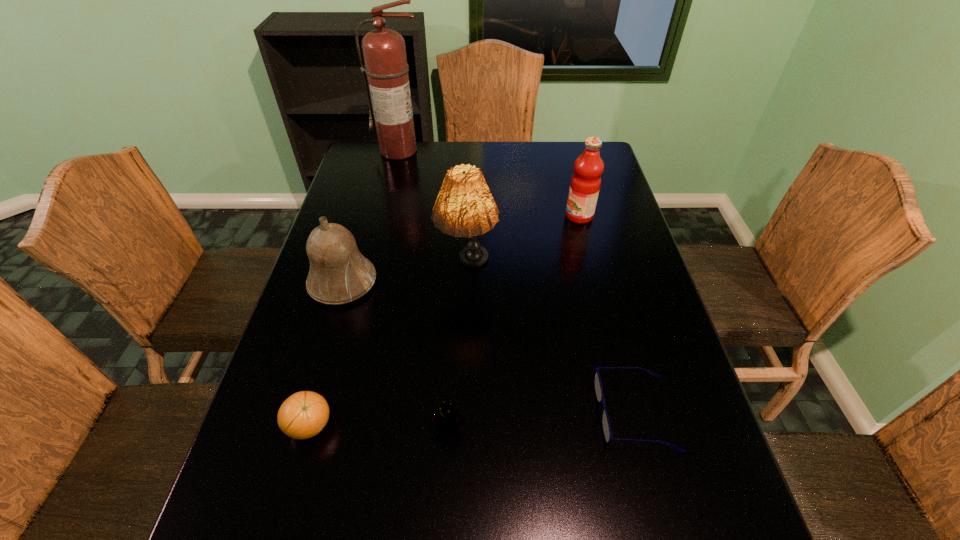
Find the location of a particular element. The height and width of the screenshot is (540, 960). the tallest object is located at coordinates (384, 52).

The height and width of the screenshot is (540, 960). What are the coordinates of `the farthest object` in the screenshot? It's located at (384, 52).

You are a GUI agent. You are given a task and a screenshot of the screen. Output one action in this format:
    pyautogui.click(x=<x>, y=<y>)
    Task: Click on the sixth shortest object
    This screenshot has height=540, width=960.
    Given the screenshot: What is the action you would take?
    pyautogui.click(x=465, y=207)

Image resolution: width=960 pixels, height=540 pixels. Identify the location of the third tallest object. (585, 183).

Find the location of a particular element. The image size is (960, 540). fruit juice is located at coordinates (585, 183).

Locate an element on the screen. the fourth shortest object is located at coordinates (339, 273).

The width and height of the screenshot is (960, 540). I want to click on Lego, so click(446, 417).

The width and height of the screenshot is (960, 540). What are the coordinates of `orange` in the screenshot? It's located at (304, 414).

Identify the location of the shortest object. This screenshot has height=540, width=960. (605, 422).

Identify the location of vacant space located 0.370m on the front-facing side of the tallest object. coord(381,227).